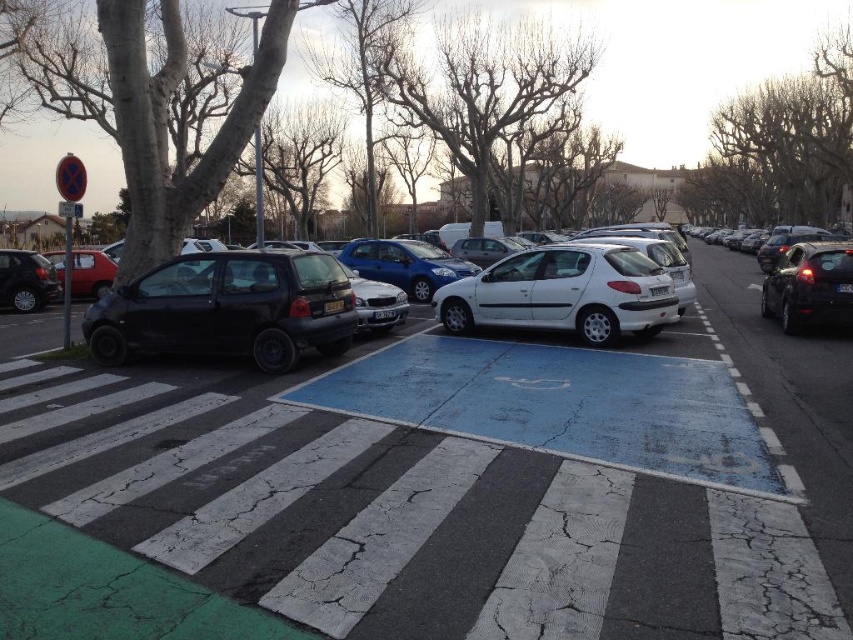
You are a pedestrian standing on the pavement near the pedestrian crossing. You notice two black cars parked at the left side of the street. Which car is closer to the pedestrian crossing, the matte black car at left or the shiny black car at left?

The shiny black car at left is closer to the pedestrian crossing because the matte black car at left is to the right of it.

You are a delivery person trying to park your van, which is 5 meters long, in the parking area near the white matte car at center and the shiny black car at left. Based on their sizes, can your van fit between them?

The white matte car at center is larger than the shiny black car at left. Since your van is 5 meters long, you need to check the available space between them. However, without knowing the exact distance between the cars, it is impossible to determine if the van will fit.